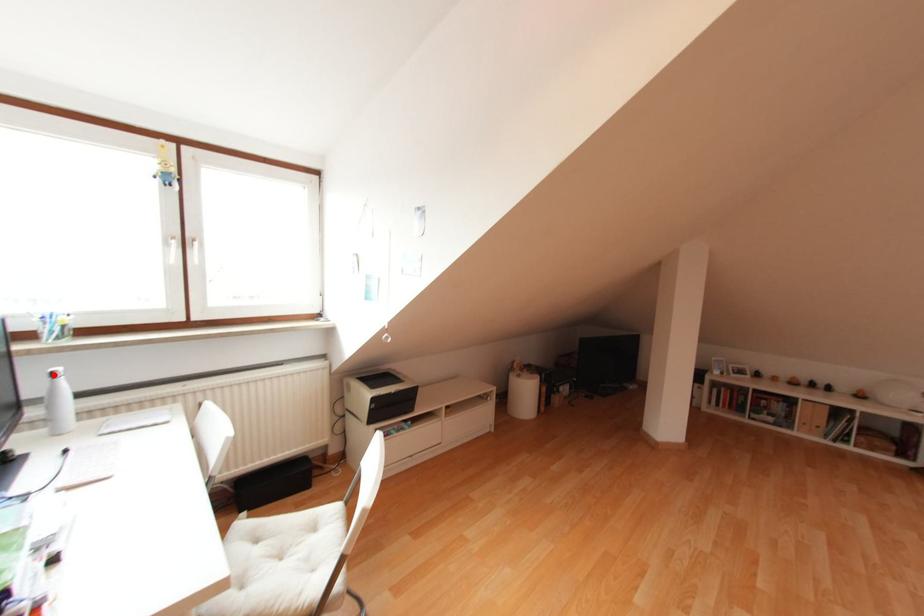
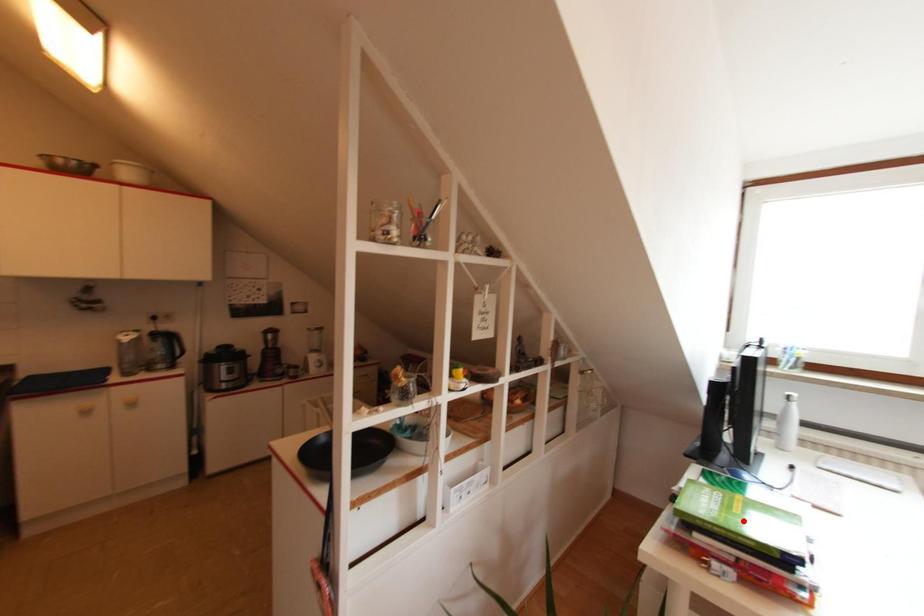
I am providing you with two images of the same scene from different viewpoints. A red point is marked on the first image and another point is marked on the second image. Are the points marked in image1 and image2 representing the same 3D position?

No